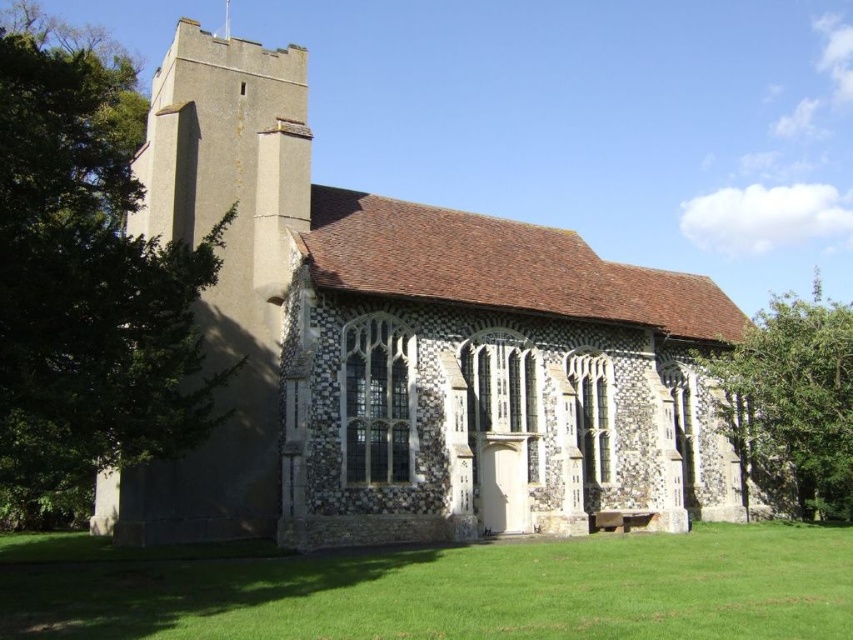
Who is taller, stone church at center or green leafy tree at left?

With more height is green leafy tree at left.

Measure the distance from stone church at center to green leafy tree at left.

stone church at center is 17.07 meters from green leafy tree at left.

You are a GUI agent. You are given a task and a screenshot of the screen. Output one action in this format:
    pyautogui.click(x=<x>, y=<y>)
    Task: Click on the stone church at center
    Image resolution: width=853 pixels, height=640 pixels.
    Given the screenshot: What is the action you would take?
    pyautogui.click(x=408, y=349)

Does green leafy tree at left appear on the right side of green grass at lower center?

No, green leafy tree at left is not to the right of green grass at lower center.

Which of these two, green leafy tree at left or green grass at lower center, stands taller?

With more height is green leafy tree at left.

Where is `green leafy tree at left`? The image size is (853, 640). green leafy tree at left is located at coordinates (85, 280).

Is stone church at center shorter than green grass at lower center?

No.

How much distance is there between stone church at center and green grass at lower center?

stone church at center and green grass at lower center are 13.85 meters apart from each other.

Who is more forward, (x=653, y=420) or (x=74, y=564)?

Point (x=74, y=564) is in front.

You are a GUI agent. You are given a task and a screenshot of the screen. Output one action in this format:
    pyautogui.click(x=<x>, y=<y>)
    Task: Click on the stone church at center
    
    Given the screenshot: What is the action you would take?
    pyautogui.click(x=408, y=349)